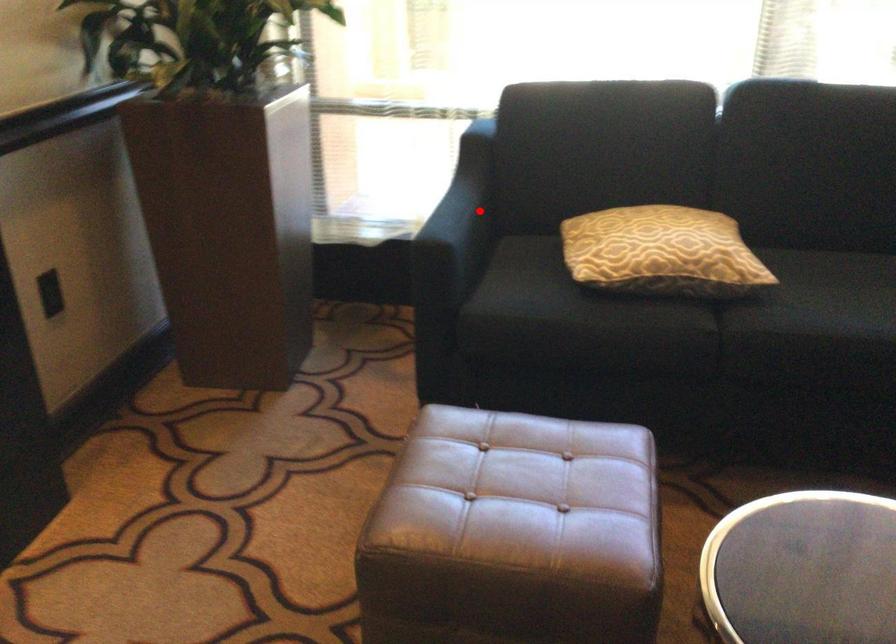
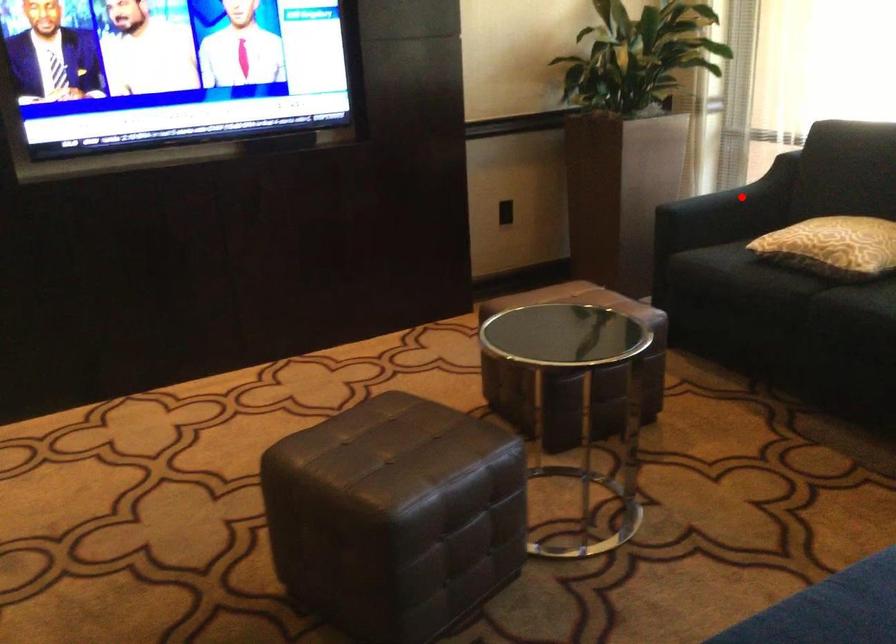
I am providing you with two images of the same scene from different viewpoints. A red point is marked on the first image and another point is marked on the second image. Is the marked point in image1 the same physical position as the marked point in image2?

Yes